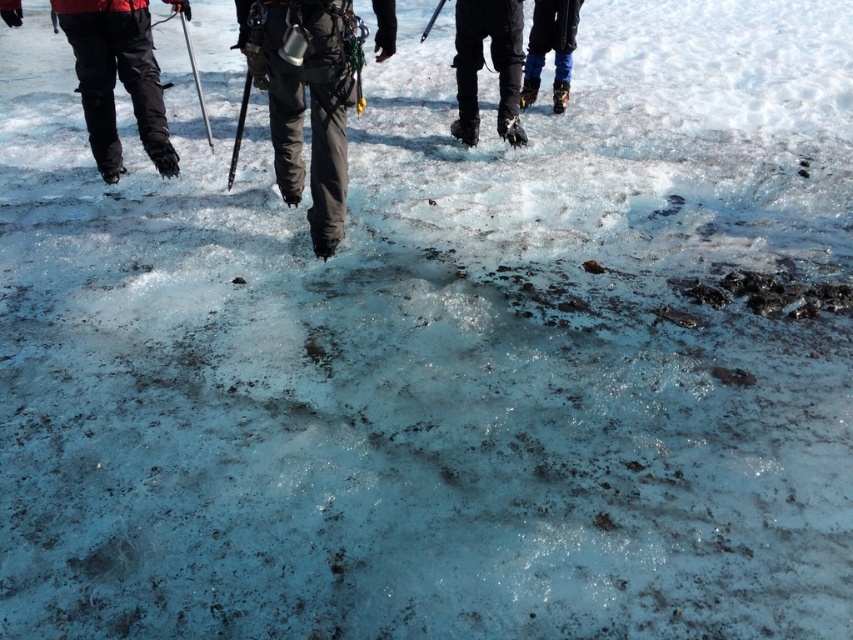
Question: Which of the following is the farthest from the observer?

Choices:
 (A) (515, 45)
 (B) (566, 26)
 (C) (184, 19)

Answer: (C)

Question: Does blue fabric pants at upper right have a larger size compared to metallic silver ski pole at center-left?

Choices:
 (A) yes
 (B) no

Answer: (B)

Question: Which object appears farthest from the camera in this image?

Choices:
 (A) black rubber boots at upper center
 (B) metallic silver ski pole at center-left
 (C) black nylon pants at center
 (D) blue fabric pants at upper right

Answer: (D)

Question: Can you confirm if black rubber boots at upper center is smaller than blue fabric pants at upper right?

Choices:
 (A) yes
 (B) no

Answer: (B)

Question: Is blue fabric pants at upper right below metallic silver ski pole at center-left?

Choices:
 (A) yes
 (B) no

Answer: (B)

Question: Which object appears closest to the camera in this image?

Choices:
 (A) blue fabric pants at upper right
 (B) black nylon pants at center
 (C) black rubber boots at upper center

Answer: (B)